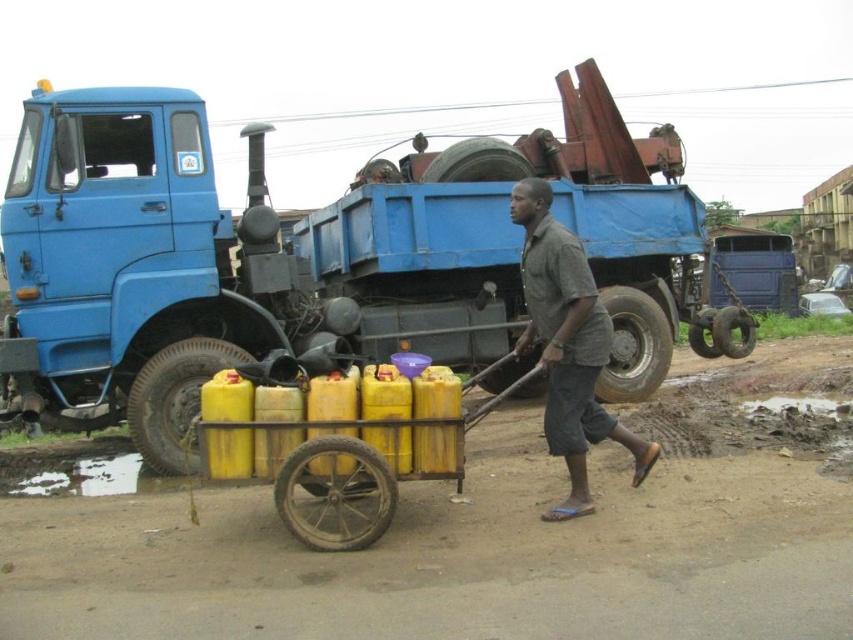
Question: Is yellow matte plastic cart at center above gray cotton shirt at center?

Choices:
 (A) no
 (B) yes

Answer: (A)

Question: Considering the relative positions of yellow matte plastic cart at center and gray cotton shirt at center in the image provided, where is yellow matte plastic cart at center located with respect to gray cotton shirt at center?

Choices:
 (A) right
 (B) left

Answer: (B)

Question: Which object is positioned farthest from the gray cotton shirt at center?

Choices:
 (A) blue matte truck at center
 (B) yellow matte plastic cart at center

Answer: (A)

Question: Is blue matte truck at center bigger than yellow matte plastic cart at center?

Choices:
 (A) yes
 (B) no

Answer: (B)

Question: Based on their relative distances, which object is nearer to the blue matte truck at center?

Choices:
 (A) yellow matte plastic cart at center
 (B) gray cotton shirt at center

Answer: (B)

Question: Which object is the closest to the yellow matte plastic cart at center?

Choices:
 (A) blue matte truck at center
 (B) gray cotton shirt at center

Answer: (B)